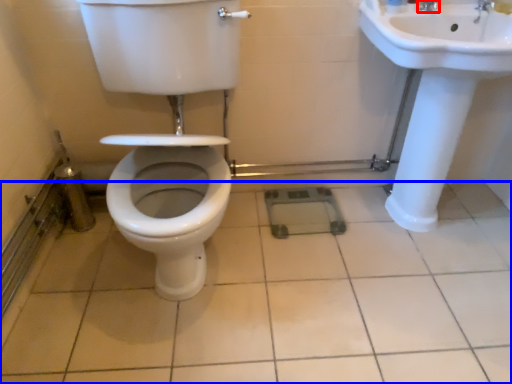
Question: Which object appears closest to the camera in this image, tap (highlighted by a red box) or ceramic tile (highlighted by a blue box)?

Choices:
 (A) tap
 (B) ceramic tile

Answer: (B)